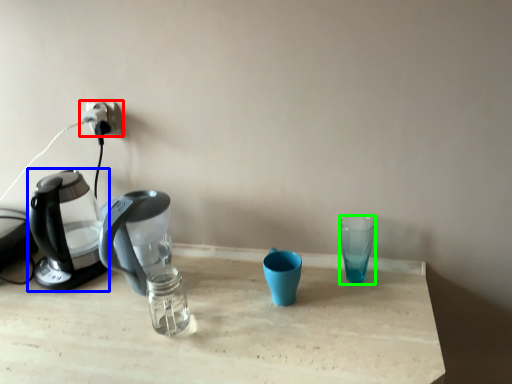
Question: Which object is the farthest from power plugs and sockets (highlighted by a red box)? Choose among these: kettle (highlighted by a blue box) or coffee cup (highlighted by a green box).

Choices:
 (A) kettle
 (B) coffee cup

Answer: (B)